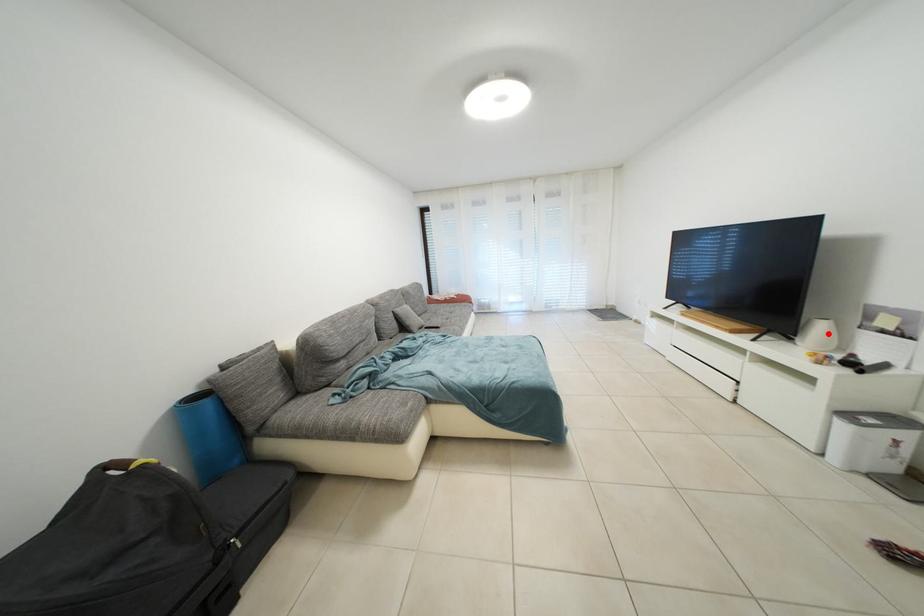
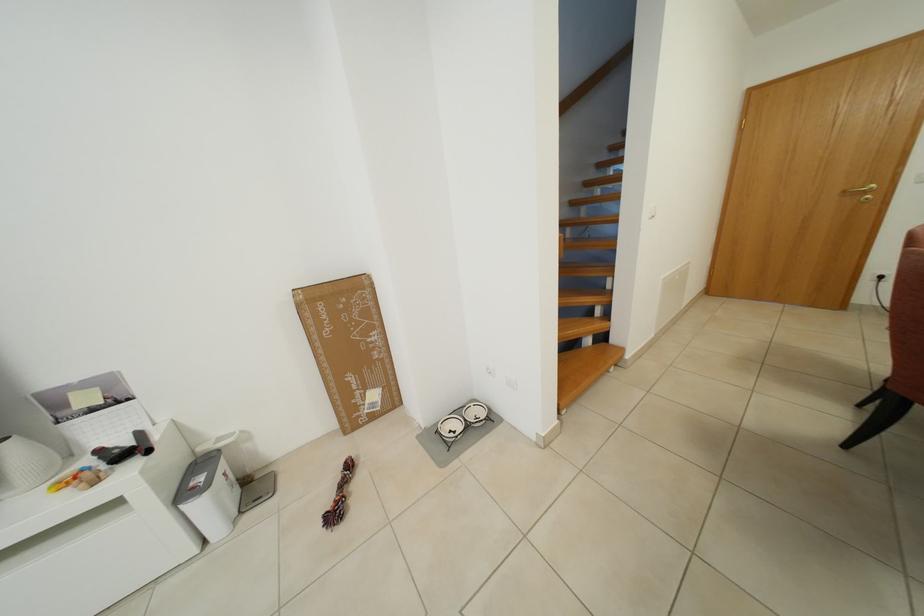
Where in the second image is the point corresponding to the highlighted location from the first image?

(21, 460)